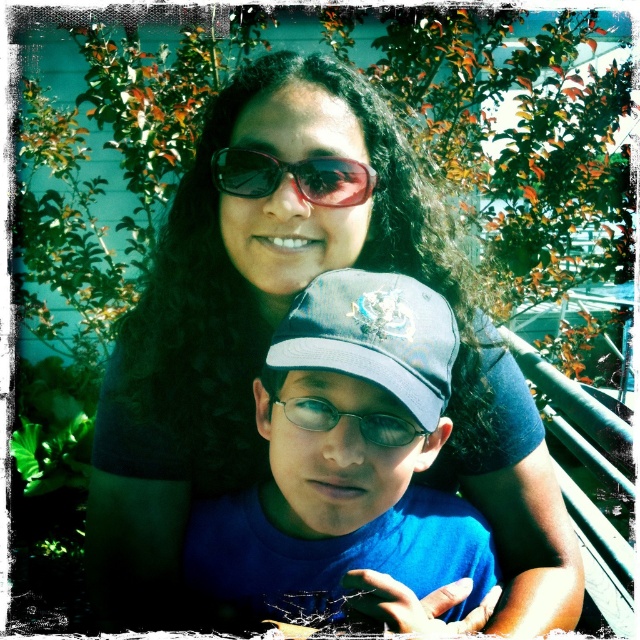
Between point (316, 541) and point (362, 168), which one is positioned in front?

Point (362, 168) is in front.

Looking at this image, does blue fabric shirt at center appear on the left side of sunglasses at upper center?

No, blue fabric shirt at center is not to the left of sunglasses at upper center.

Where is `blue fabric shirt at center`? The width and height of the screenshot is (640, 640). blue fabric shirt at center is located at coordinates (346, 460).

Is point (353, 326) closer to camera compared to point (365, 180)?

Yes.

Which is in front, point (388, 336) or point (234, 172)?

Point (388, 336)

Is point (308, 355) closer to viewer compared to point (224, 163)?

That is True.

At what (x,y) coordinates should I click in order to perform the action: click on blue fabric baseball cap at center. Please return your answer as a coordinate pair (x, y). The image size is (640, 640). Looking at the image, I should click on (372, 337).

Which is below, matte black sunglasses at upper center or blue fabric shirt at center?

Positioned lower is blue fabric shirt at center.

Where is `matte black sunglasses at upper center`? This screenshot has width=640, height=640. matte black sunglasses at upper center is located at coordinates (268, 346).

Locate an element on the screen. Image resolution: width=640 pixels, height=640 pixels. matte black sunglasses at upper center is located at coordinates (268, 346).